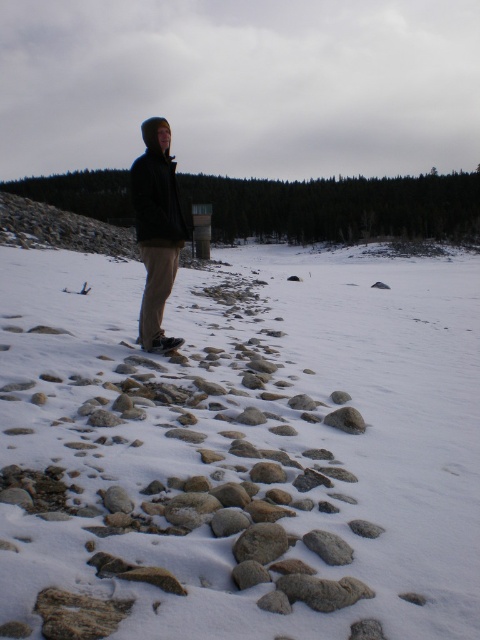
Question: Observing the image, what is the correct spatial positioning of matte black jacket at center in reference to gray rough rock at lower center?

Choices:
 (A) below
 (B) above

Answer: (B)

Question: Which is nearer to the gray rough rock at lower center?

Choices:
 (A) white matte snow at center
 (B) smooth gray rock at center

Answer: (B)

Question: Is gray rough rock at lower center further to camera compared to smooth gray rock at center?

Choices:
 (A) no
 (B) yes

Answer: (A)

Question: Which of the following is the closest to the observer?

Choices:
 (A) (140, 484)
 (B) (134, 209)

Answer: (A)

Question: Which object is positioned farthest from the smooth gray rock at center?

Choices:
 (A) gray rough rock at lower center
 (B) white matte snow at center
 (C) matte black jacket at center

Answer: (B)

Question: Can you confirm if matte black jacket at center is positioned to the left of smooth gray rock at center?

Choices:
 (A) no
 (B) yes

Answer: (B)